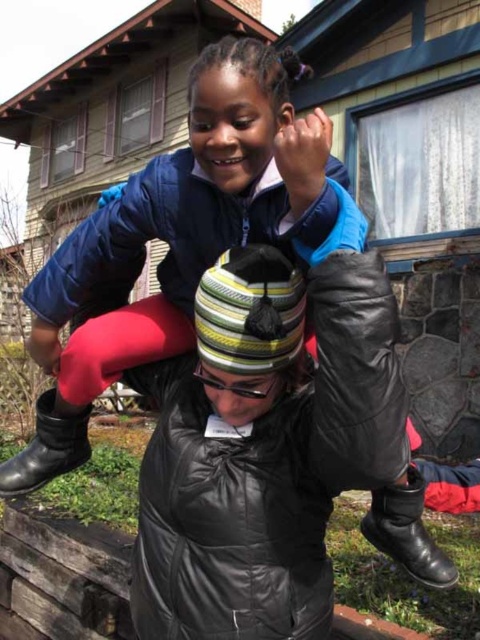
Question: Among these objects, which one is nearest to the camera?

Choices:
 (A) black leather boot at lower left
 (B) black leather boot at lower center

Answer: (B)

Question: Is black leather boot at lower center positioned behind black leather boot at lower left?

Choices:
 (A) yes
 (B) no

Answer: (B)

Question: Does black leather boot at lower center have a smaller size compared to black leather boot at lower left?

Choices:
 (A) yes
 (B) no

Answer: (A)

Question: Is black leather boot at lower center above black leather boot at lower left?

Choices:
 (A) yes
 (B) no

Answer: (B)